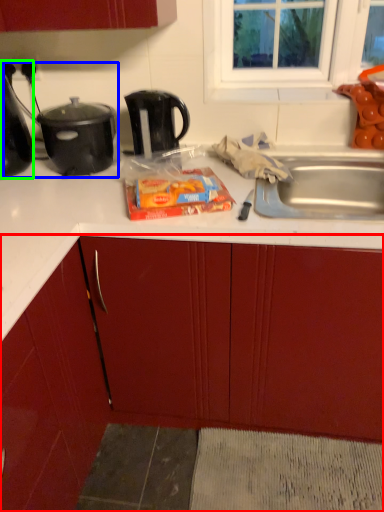
Question: Which object is the farthest from cabinetry (highlighted by a red box)? Choose among these: appliance (highlighted by a blue box) or kitchen appliance (highlighted by a green box).

Choices:
 (A) appliance
 (B) kitchen appliance

Answer: (B)